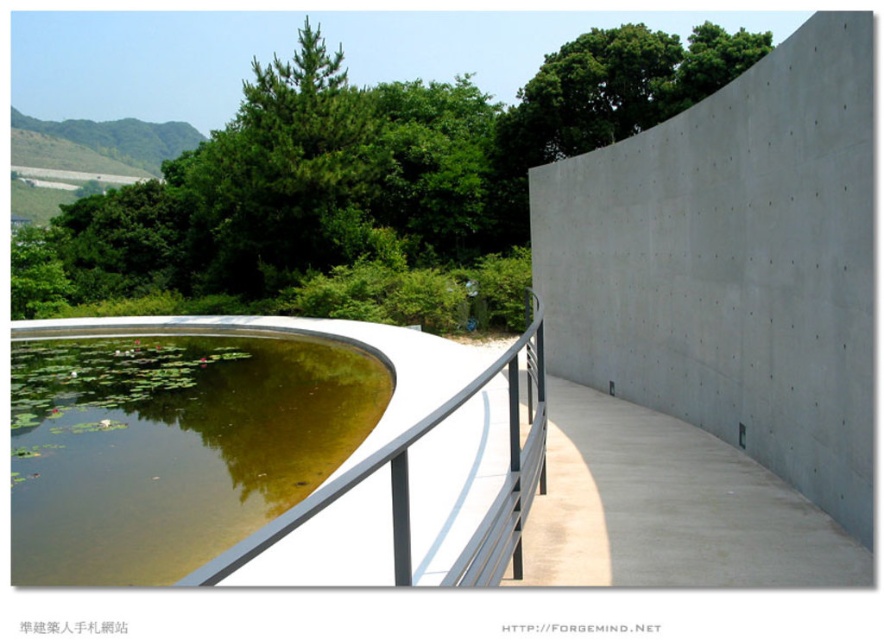
Question: Can you confirm if gray concrete wall at upper right is positioned to the right of greenish water at center?

Choices:
 (A) no
 (B) yes

Answer: (B)

Question: Can you confirm if greenish water at center is positioned below metallic silver balustrade at lower left?

Choices:
 (A) yes
 (B) no

Answer: (A)

Question: Among these objects, which one is nearest to the camera?

Choices:
 (A) gray concrete wall at upper right
 (B) green leafy tree at upper center
 (C) metallic silver balustrade at lower left
 (D) greenish water at center

Answer: (C)

Question: Which of these objects is positioned closest to the smooth concrete path at center?

Choices:
 (A) greenish water at center
 (B) gray concrete wall at upper right
 (C) green leafy tree at upper center

Answer: (B)

Question: Among these points, which one is farthest from the camera?

Choices:
 (A) (503, 513)
 (B) (215, 460)
 (C) (557, 452)

Answer: (B)

Question: From the image, what is the correct spatial relationship of gray concrete wall at upper right in relation to green leafy tree at upper center?

Choices:
 (A) left
 (B) right

Answer: (B)